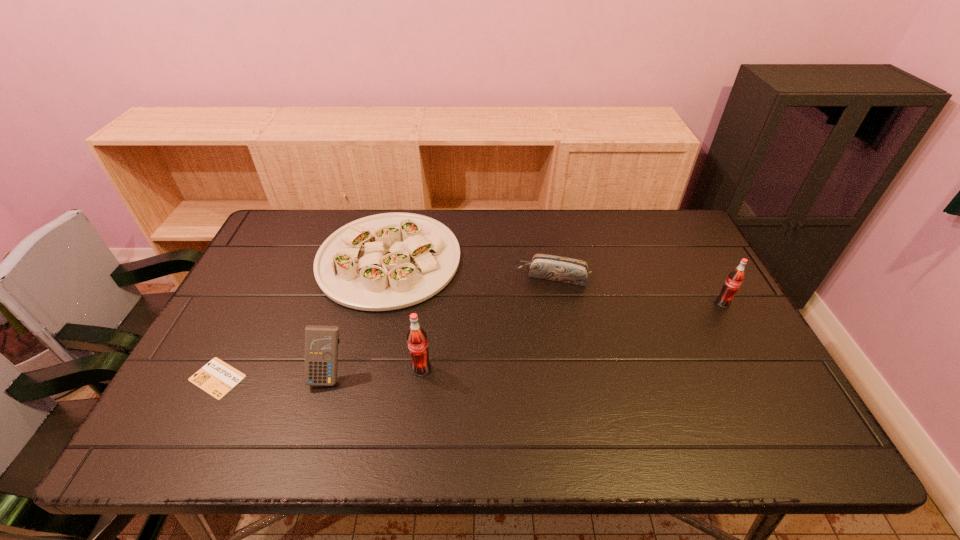
Where is `free region located 0.140m on the label of the rightmost object`? free region located 0.140m on the label of the rightmost object is located at coordinates (747, 348).

This screenshot has height=540, width=960. I want to click on free space located 0.230m on the right of the platter, so click(533, 259).

Where is `free space located on the right of the pencil box`? free space located on the right of the pencil box is located at coordinates (651, 276).

Identify the location of free space located 0.170m on the back of the leftmost object. (253, 308).

Find the location of a particular element. object located at the far edge is located at coordinates (388, 261).

Locate an element on the screen. calculator that is at the near edge is located at coordinates [x=321, y=342].

You are a GUI agent. You are given a task and a screenshot of the screen. Output one action in this format:
    pyautogui.click(x=<x>, y=<y>)
    Task: Click on the identity card that is at the near edge
    The width and height of the screenshot is (960, 540).
    Given the screenshot: What is the action you would take?
    pyautogui.click(x=217, y=378)

Identify the location of object that is at the left edge. This screenshot has height=540, width=960. [217, 378].

Locate an element on the screen. object that is positioned at the right edge is located at coordinates (735, 278).

The image size is (960, 540). I want to click on object that is positioned at the near left corner, so click(217, 378).